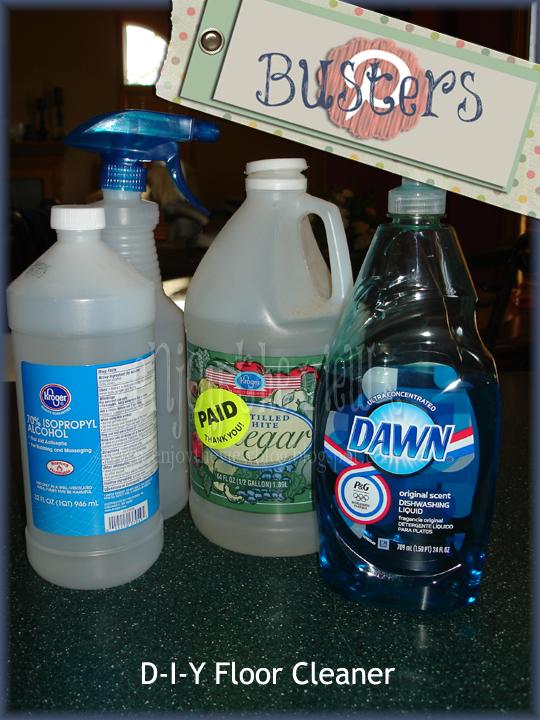
Identify the location of spray bottle. This screenshot has width=540, height=720. (137, 237).